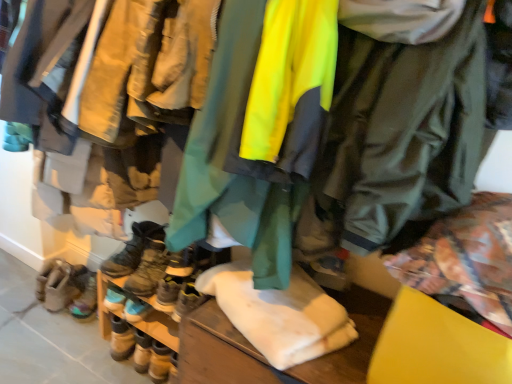
The height and width of the screenshot is (384, 512). I want to click on vacant space in front of leather boots at lower left, the 5th footwear when ordered from right to left, so (49, 331).